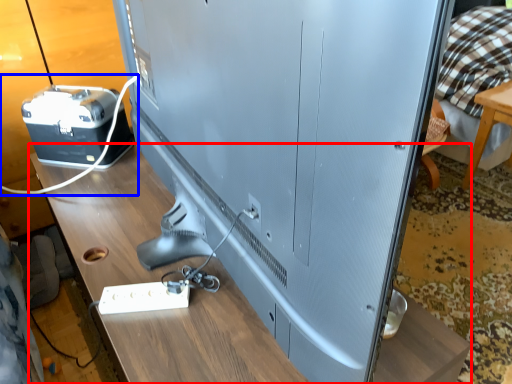
Question: Among these objects, which one is farthest to the camera, table (highlighted by a red box) or wire (highlighted by a blue box)?

Choices:
 (A) table
 (B) wire

Answer: (B)